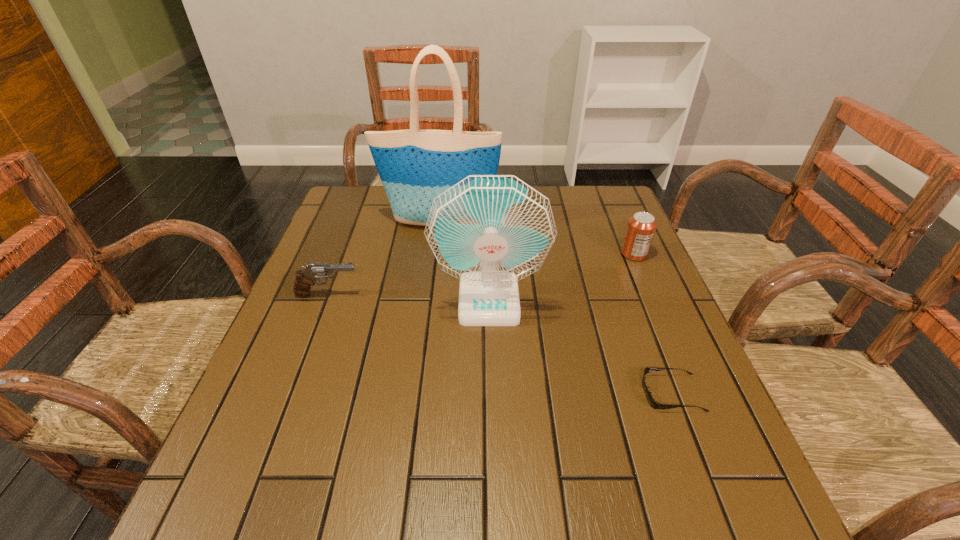
This screenshot has width=960, height=540. I want to click on free point between the second farthest object and the shortest object, so click(x=653, y=323).

Image resolution: width=960 pixels, height=540 pixels. What are the coordinates of `vacant space that is in between the fan and the fourth nearest object` in the screenshot? It's located at (562, 277).

At what (x,y) coordinates should I click in order to perform the action: click on empty location between the nearest object and the second farthest object. Please return your answer as a coordinate pair (x, y). This screenshot has height=540, width=960. Looking at the image, I should click on (653, 323).

The image size is (960, 540). Identify the location of empty space that is in between the pistol and the sunglasses. (500, 343).

The height and width of the screenshot is (540, 960). In order to click on object that is the closest one to the pistol in this screenshot , I will do `click(490, 231)`.

In order to click on the second closest object to the shortest object in this screenshot , I will do `click(641, 227)`.

Where is `free space that satisfies the following two spatial constraints: 1. on the front side of the can; 2. on the front-facing side of the shortest object`? The width and height of the screenshot is (960, 540). free space that satisfies the following two spatial constraints: 1. on the front side of the can; 2. on the front-facing side of the shortest object is located at coordinates (693, 393).

The image size is (960, 540). What are the coordinates of `free space that satisfies the following two spatial constraints: 1. on the front side of the tallest object; 2. on the right side of the can` in the screenshot? It's located at (436, 254).

Find the location of a particular element. vacant space that satisfies the following two spatial constraints: 1. on the front side of the second farthest object; 2. at the barrel of the second shortest object is located at coordinates (651, 295).

The height and width of the screenshot is (540, 960). Find the location of `free location that satisfies the following two spatial constraints: 1. on the front side of the farthest object; 2. at the barrel of the pistol`. free location that satisfies the following two spatial constraints: 1. on the front side of the farthest object; 2. at the barrel of the pistol is located at coordinates (431, 295).